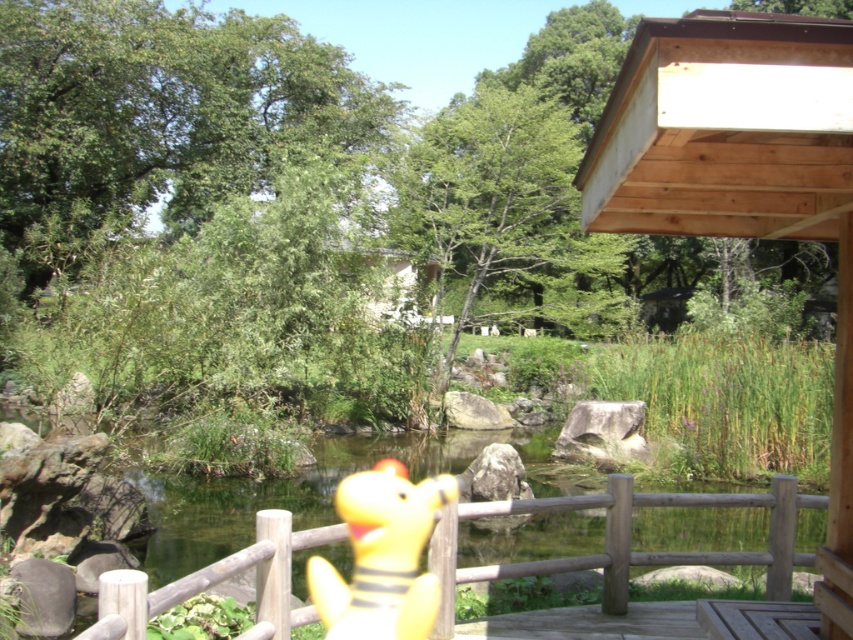
You are standing at the edge of the pond in the image. There is a wooden railing in front of you. Can you see the wooden part of the railing at the point marked by coordinates point (624, 540)?

Yes, the wooden part of the railing is located at point (624, 540), so you can see it there.

You are standing at the camera position and want to reach the wooden at center without crossing the water. Can you walk directly to it along the ground? Explain your reasoning based on the distance provided.

The wooden at center and camera are 4.43 meters apart. Since the wooden at center is part of the railing in the foreground, which separates the viewer from the water, you can walk directly to it along the ground as the distance is manageable and doesn

You are standing at the edge of the pond and see the wooden at center and the yellow rubber duck at center. Which object is wider?

The wooden at center is wider than the yellow rubber duck at center according to the description.